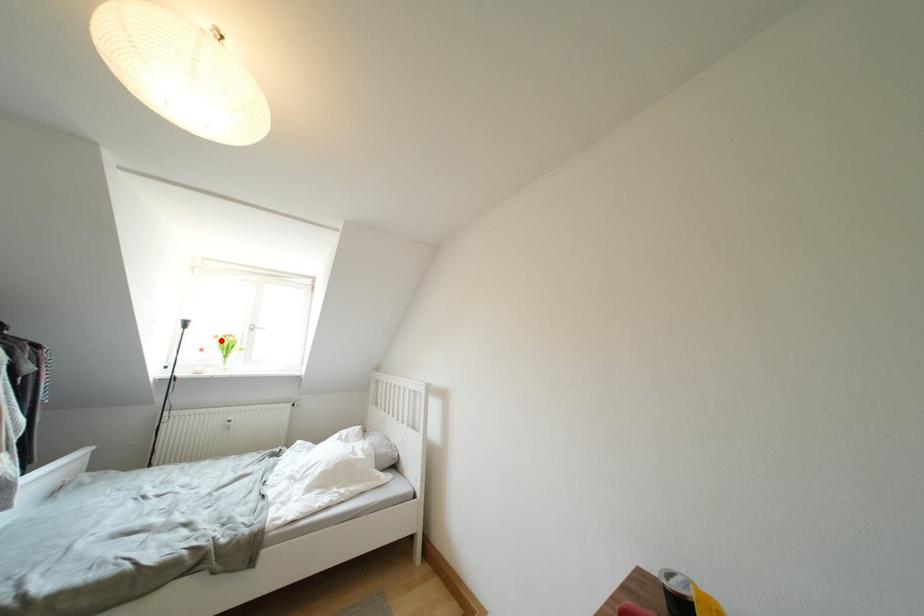
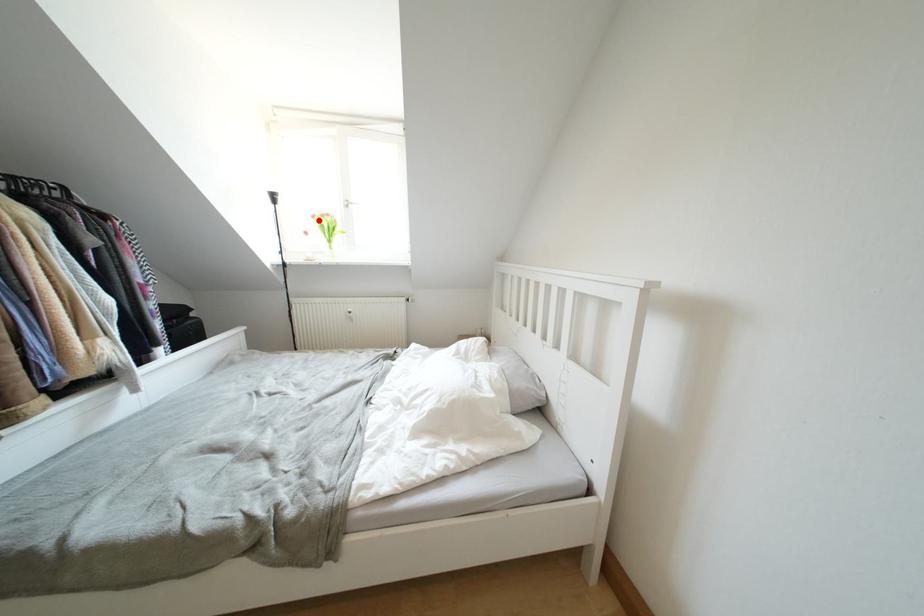
Consider the image. I am providing you with two images of the same scene from different viewpoints. A red point is marked on the first image and another point is marked on the second image. Is the red point in image1 aligned with the point shown in image2?

Yes